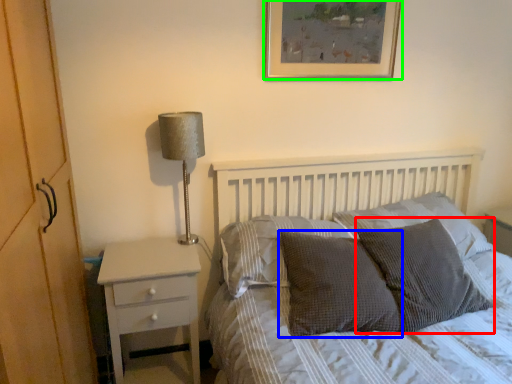
Question: Which object is the farthest from pillow (highlighted by a red box)? Choose among these: pillow (highlighted by a blue box) or picture frame (highlighted by a green box).

Choices:
 (A) pillow
 (B) picture frame

Answer: (B)